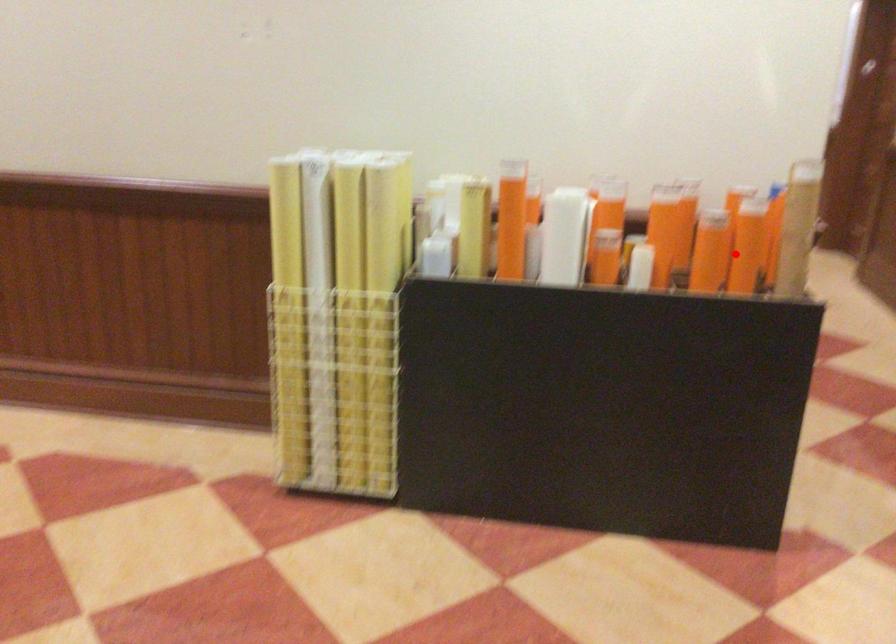
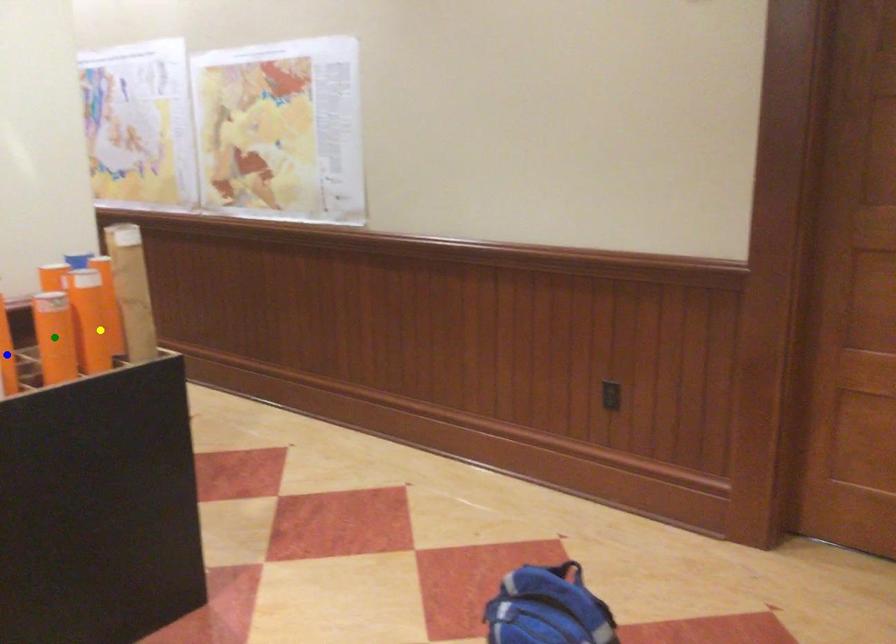
Question: I am providing you with two images of the same scene from different viewpoints. A red point is marked on the first image. You are given multiple points on the second image. In image 2, which mark is for the same physical point as the one in image 1?

Choices:
 (A) green point
 (B) yellow point
 (C) blue point

Answer: (B)